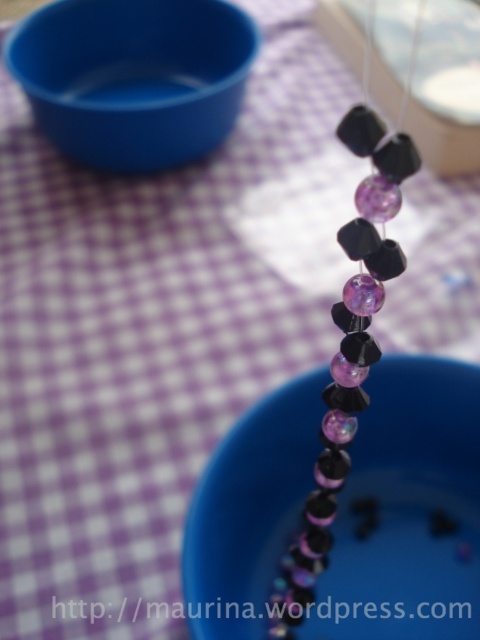
Question: Does blue plastic bowl at upper left come behind translucent glass beads at center?

Choices:
 (A) yes
 (B) no

Answer: (A)

Question: Is blue plastic bowl at upper left to the right of translucent glass beads at center from the viewer's perspective?

Choices:
 (A) no
 (B) yes

Answer: (A)

Question: From the image, what is the correct spatial relationship of blue plastic bowl at upper left in relation to translucent glass beads at center?

Choices:
 (A) right
 (B) left

Answer: (B)